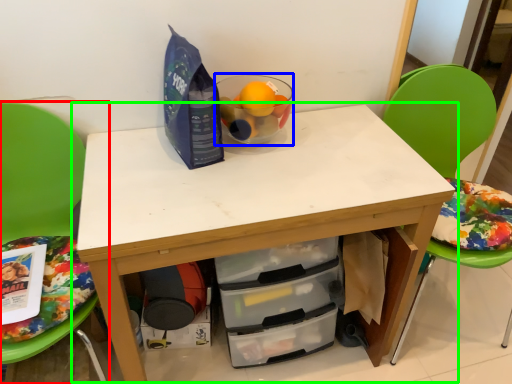
Question: Which is nearer to the chair (highlighted by a red box)? bowl (highlighted by a blue box) or table (highlighted by a green box).

Choices:
 (A) bowl
 (B) table

Answer: (B)